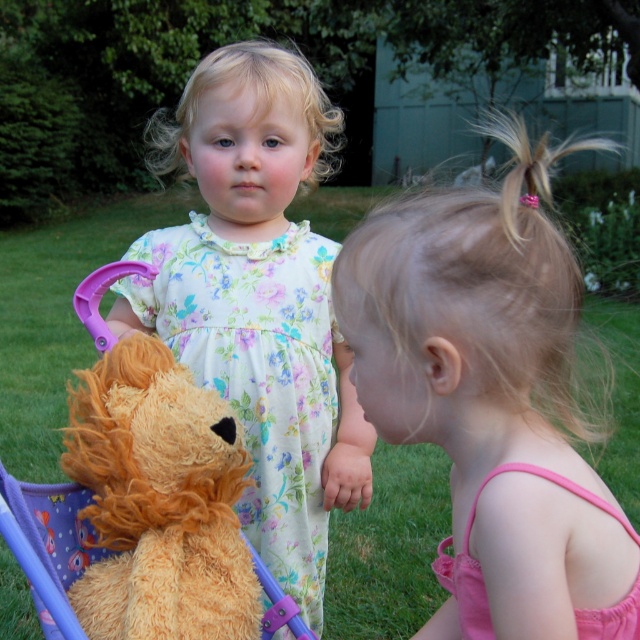
Question: In this image, where is pink fabric dress at center located relative to fluffy white dress at center?

Choices:
 (A) left
 (B) right

Answer: (B)

Question: Which point is farther to the camera?

Choices:
 (A) fluffy white dress at center
 (B) fuzzy orange teddy bear at left
 (C) pink satin dress at lower right
 (D) pink fabric dress at center

Answer: (A)

Question: Which of the following is the farthest from the observer?

Choices:
 (A) (480, 456)
 (B) (275, 438)
 (C) (618, 512)
 (D) (106, 536)

Answer: (B)

Question: Is pink fabric dress at center thinner than fuzzy orange teddy bear at left?

Choices:
 (A) no
 (B) yes

Answer: (B)

Question: Can you confirm if fuzzy orange teddy bear at left is wider than pink satin dress at lower right?

Choices:
 (A) no
 (B) yes

Answer: (B)

Question: Which point is farther to the camera?

Choices:
 (A) pink fabric dress at center
 (B) fuzzy orange teddy bear at left

Answer: (B)